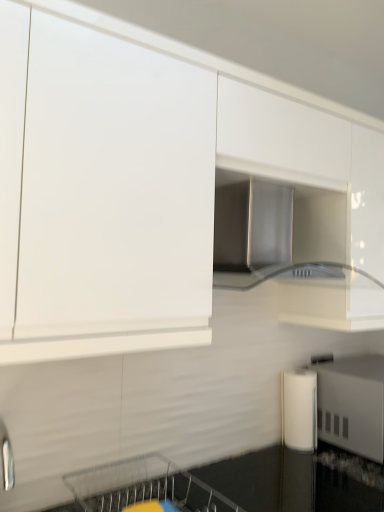
This screenshot has height=512, width=384. Describe the element at coordinates (299, 410) in the screenshot. I see `white matte cylindrical container at lower right, which ranks as the second appliance in right-to-left order` at that location.

What do you see at coordinates (144, 486) in the screenshot?
I see `metallic silver dishwasher at lower center` at bounding box center [144, 486].

Locate an element on the screen. This screenshot has width=384, height=512. white glossy paper towel dispenser at lower right, the first appliance positioned from the right is located at coordinates (352, 404).

Image resolution: width=384 pixels, height=512 pixels. Find the location of `white matte cylindrical container at lower right, which ranks as the second appliance in right-to-left order`. white matte cylindrical container at lower right, which ranks as the second appliance in right-to-left order is located at coordinates [299, 410].

Does white matte cylindrical container at lower right, positioned as the first appliance in left-to-right order, have a larger size compared to black glossy countertop at lower center?

Incorrect, white matte cylindrical container at lower right, positioned as the first appliance in left-to-right order, is not larger than black glossy countertop at lower center.

Is white matte cylindrical container at lower right, which ranks as the second appliance in right-to-left order, oriented towards black glossy countertop at lower center?

No, white matte cylindrical container at lower right, which ranks as the second appliance in right-to-left order, is not oriented towards black glossy countertop at lower center.

Considering the positions of point (294, 439) and point (247, 471), is point (294, 439) closer or farther from the camera than point (247, 471)?

Point (294, 439) is farther from the camera than point (247, 471).

Consider the image. Is white matte cylindrical container at lower right, positioned as the first appliance in left-to-right order, not near black glossy countertop at lower center?

No, white matte cylindrical container at lower right, positioned as the first appliance in left-to-right order, is not far away from black glossy countertop at lower center.

Is black glossy countertop at lower center next to white glossy cabinet at upper center and touching it?

No, black glossy countertop at lower center is not next to white glossy cabinet at upper center.

Considering the relative positions of black glossy countertop at lower center and white glossy cabinet at upper center in the image provided, is black glossy countertop at lower center to the right of white glossy cabinet at upper center from the viewer's perspective?

Correct, you'll find black glossy countertop at lower center to the right of white glossy cabinet at upper center.

Is white glossy paper towel dispenser at lower right, the first appliance positioned from the right, at the right side of white glossy cabinet at upper center?

Yes.

Find the location of a particular element. The height and width of the screenshot is (512, 384). appliance that is the 2nd object to the right of the white glossy cabinet at upper center, starting at the anchor is located at coordinates (352, 404).

Can you confirm if white glossy paper towel dispenser at lower right, placed as the 2th appliance when sorted from left to right, is taller than white glossy cabinet at upper center?

No.

Is white glossy paper towel dispenser at lower right, the first appliance positioned from the right, next to white glossy cabinet at upper center and touching it?

white glossy paper towel dispenser at lower right, the first appliance positioned from the right, and white glossy cabinet at upper center are clearly separated.

Visually, is white glossy cabinet at upper center positioned to the left or to the right of metallic silver dishwasher at lower center?

white glossy cabinet at upper center is to the right of metallic silver dishwasher at lower center.

Between white glossy cabinet at upper center and metallic silver dishwasher at lower center, which one has smaller size?

Smaller between the two is metallic silver dishwasher at lower center.

Looking at this image, would you say white glossy cabinet at upper center is a long distance from metallic silver dishwasher at lower center?

white glossy cabinet at upper center is actually quite close to metallic silver dishwasher at lower center.

Which of these two, white glossy cabinet at upper center or metallic silver dishwasher at lower center, stands shorter?

metallic silver dishwasher at lower center.

In the image, is white glossy paper towel dispenser at lower right, the first appliance positioned from the right, on the left side or the right side of stainless steel range hood at center?

From the image, it's evident that white glossy paper towel dispenser at lower right, the first appliance positioned from the right, is to the right of stainless steel range hood at center.

Is stainless steel range hood at center at the back of white glossy paper towel dispenser at lower right, placed as the 2th appliance when sorted from left to right?

white glossy paper towel dispenser at lower right, placed as the 2th appliance when sorted from left to right, does not have its back to stainless steel range hood at center.

How different are the orientations of white glossy paper towel dispenser at lower right, placed as the 2th appliance when sorted from left to right, and stainless steel range hood at center in degrees?

The angular difference between white glossy paper towel dispenser at lower right, placed as the 2th appliance when sorted from left to right, and stainless steel range hood at center is 0.079 degrees.

From the image's perspective, which is above, stainless steel range hood at center or white matte cylindrical container at lower right, which ranks as the second appliance in right-to-left order?

stainless steel range hood at center is shown above in the image.

Is point (301, 194) positioned before point (300, 437)?

That is True.

In terms of width, does stainless steel range hood at center look wider or thinner when compared to white matte cylindrical container at lower right, positioned as the first appliance in left-to-right order?

stainless steel range hood at center is wider than white matte cylindrical container at lower right, positioned as the first appliance in left-to-right order.

Who is taller, stainless steel range hood at center or white matte cylindrical container at lower right, positioned as the first appliance in left-to-right order?

Standing taller between the two is stainless steel range hood at center.

Identify the location of dish washer on the left side of white glossy paper towel dispenser at lower right, placed as the 2th appliance when sorted from left to right. The width and height of the screenshot is (384, 512). (144, 486).

Is metallic silver dishwasher at lower center next to white glossy paper towel dispenser at lower right, the first appliance positioned from the right, and touching it?

No, metallic silver dishwasher at lower center is not making contact with white glossy paper towel dispenser at lower right, the first appliance positioned from the right.

Does metallic silver dishwasher at lower center have a smaller size compared to white glossy paper towel dispenser at lower right, the first appliance positioned from the right?

Correct, metallic silver dishwasher at lower center occupies less space than white glossy paper towel dispenser at lower right, the first appliance positioned from the right.

Consider the image. Considering the positions of objects metallic silver dishwasher at lower center and white glossy paper towel dispenser at lower right, the first appliance positioned from the right, in the image provided, who is more to the right, metallic silver dishwasher at lower center or white glossy paper towel dispenser at lower right, the first appliance positioned from the right,?

white glossy paper towel dispenser at lower right, the first appliance positioned from the right, is more to the right.

Where is `countertop located on the left of white matte cylindrical container at lower right, positioned as the first appliance in left-to-right order`? This screenshot has width=384, height=512. countertop located on the left of white matte cylindrical container at lower right, positioned as the first appliance in left-to-right order is located at coordinates (288, 483).

Locate an element on the screen. This screenshot has height=512, width=384. cabinetry above the black glossy countertop at lower center (from the image's perspective) is located at coordinates (150, 184).

Which object lies further to the anchor point metallic silver dishwasher at lower center, white glossy cabinet at upper center or stainless steel range hood at center?

stainless steel range hood at center.

Which object lies further to the anchor point black glossy countertop at lower center, metallic silver dishwasher at lower center or white matte cylindrical container at lower right, which ranks as the second appliance in right-to-left order?

Based on the image, white matte cylindrical container at lower right, which ranks as the second appliance in right-to-left order, appears to be further to black glossy countertop at lower center.

From the image, which object appears to be nearer to white glossy cabinet at upper center, metallic silver dishwasher at lower center or stainless steel range hood at center?

→ Among the two, stainless steel range hood at center is located nearer to white glossy cabinet at upper center.

Considering their positions, is stainless steel range hood at center positioned closer to white glossy cabinet at upper center than white glossy paper towel dispenser at lower right, placed as the 2th appliance when sorted from left to right?

Among the two, stainless steel range hood at center is located nearer to white glossy cabinet at upper center.

When comparing their distances from stainless steel range hood at center, does white glossy cabinet at upper center or black glossy countertop at lower center seem further?

black glossy countertop at lower center lies further to stainless steel range hood at center than the other object.

Considering their positions, is white matte cylindrical container at lower right, positioned as the first appliance in left-to-right order, positioned closer to white glossy paper towel dispenser at lower right, placed as the 2th appliance when sorted from left to right, than stainless steel range hood at center?

white matte cylindrical container at lower right, positioned as the first appliance in left-to-right order.

Based on the photo, considering their positions, is white matte cylindrical container at lower right, which ranks as the second appliance in right-to-left order, positioned further to white glossy cabinet at upper center than black glossy countertop at lower center?

black glossy countertop at lower center is positioned further to the anchor white glossy cabinet at upper center.

Consider the image. Looking at the image, which one is located closer to white glossy paper towel dispenser at lower right, the first appliance positioned from the right, white matte cylindrical container at lower right, which ranks as the second appliance in right-to-left order, or black glossy countertop at lower center?

Among the two, white matte cylindrical container at lower right, which ranks as the second appliance in right-to-left order, is located nearer to white glossy paper towel dispenser at lower right, the first appliance positioned from the right.

The width and height of the screenshot is (384, 512). What are the coordinates of `dish washer that lies between stainless steel range hood at center and black glossy countertop at lower center from top to bottom` in the screenshot? It's located at (144, 486).

Where is `home appliance located between metallic silver dishwasher at lower center and white glossy paper towel dispenser at lower right, the first appliance positioned from the right, in the left-right direction`? This screenshot has width=384, height=512. home appliance located between metallic silver dishwasher at lower center and white glossy paper towel dispenser at lower right, the first appliance positioned from the right, in the left-right direction is located at coordinates (274, 226).

Locate an element on the screen. home appliance that lies between white glossy cabinet at upper center and white glossy paper towel dispenser at lower right, placed as the 2th appliance when sorted from left to right, from top to bottom is located at coordinates (274, 226).

Identify the location of countertop between metallic silver dishwasher at lower center and white matte cylindrical container at lower right, which ranks as the second appliance in right-to-left order, in the front-back direction. (288, 483).